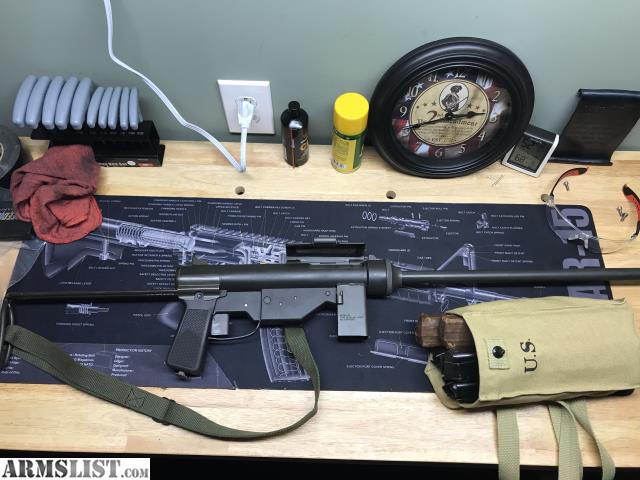
This screenshot has height=480, width=640. I want to click on clock, so click(x=506, y=83).